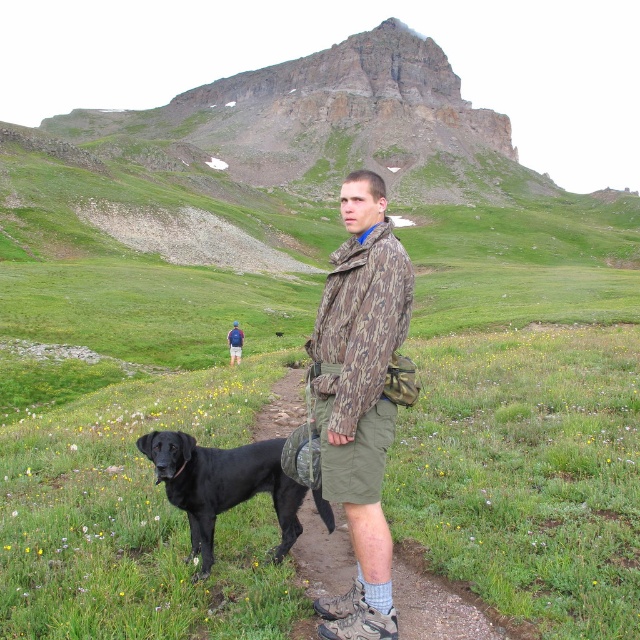
Question: Which object appears farthest from the camera in this image?

Choices:
 (A) camo jacket at center
 (B) green fabric pants at center

Answer: (A)

Question: Which object appears farthest from the camera in this image?

Choices:
 (A) camouflage jacket at center
 (B) camouflagematerial/texture at center

Answer: (A)

Question: Is camo jacket at center closer to camera compared to black matte dog at lower left?

Choices:
 (A) no
 (B) yes

Answer: (B)

Question: Which of the following is the farthest from the observer?

Choices:
 (A) camo jacket at center
 (B) green fabric pants at center
 (C) black matte dog at lower left
 (D) camouflage jacket at center

Answer: (D)

Question: Can you confirm if black matte dog at lower left is bigger than camouflage jacket at center?

Choices:
 (A) yes
 (B) no

Answer: (B)

Question: Is camo jacket at center to the left of black matte dog at lower left from the viewer's perspective?

Choices:
 (A) no
 (B) yes

Answer: (A)